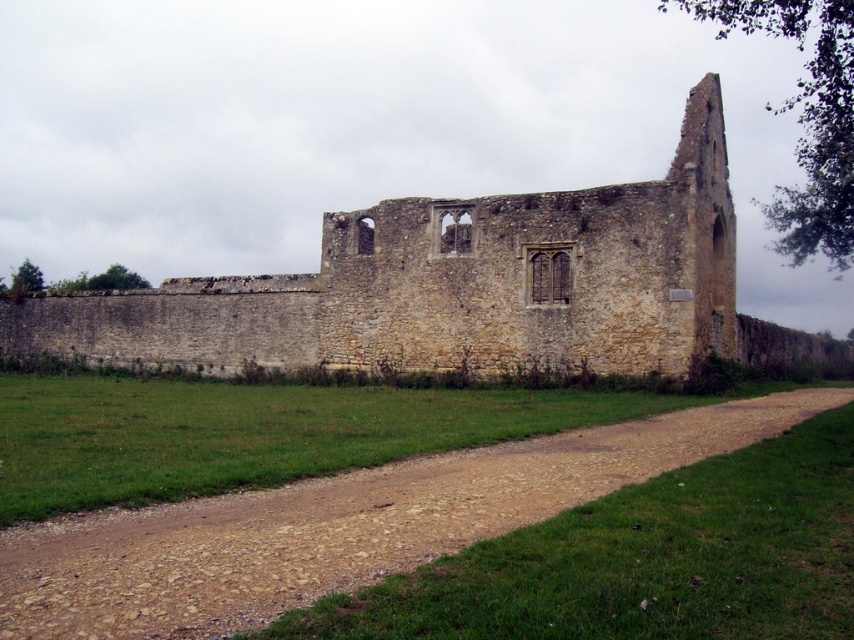
Consider the image. You are standing at the entrance of the historical stone structure and notice two points marked in the scene. The first point is at coordinates point (629,188) and the second is at point (475,464). If you want to take a photo that includes both points clearly, which point should you focus on first to ensure both are in focus?

You should focus on point (629,188) first because it is closer to the camera than point (475,464). By focusing on the closer point, the farther point will also be within the depth of field, ensuring both are in focus.